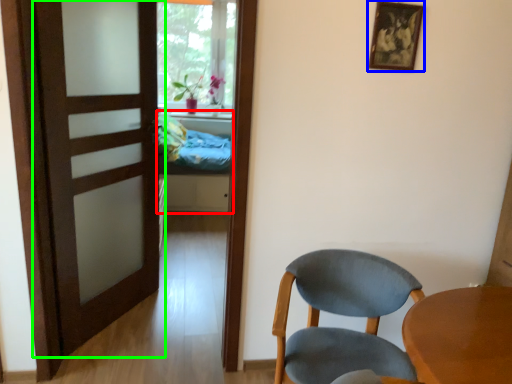
Question: Which is nearer to the bed (highlighted by a red box)? picture frame (highlighted by a blue box) or door (highlighted by a green box).

Choices:
 (A) picture frame
 (B) door

Answer: (B)